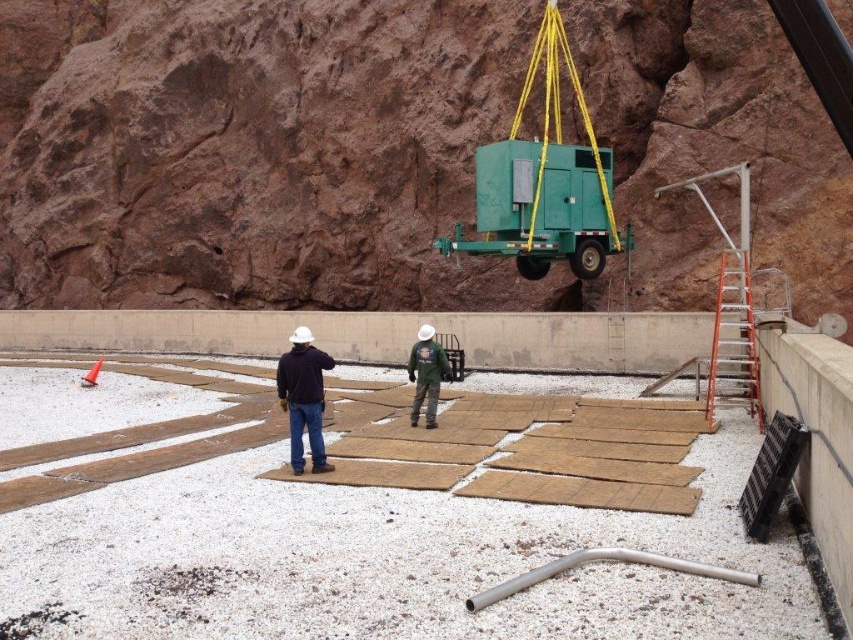
You are a safety inspector assessing the construction site. You need to ensure that the brown wood planks at center can support the green matte trailer at upper center if it were to be placed there. Based on their widths, is this possible?

The brown wood planks at center are wider than the green matte trailer at upper center, so they can support the trailer if placed there.

You are a safety inspector checking the construction site. You notice the brown wood planks at center and the matte black jacket at center. Which object is positioned higher in the image?

The brown wood planks at center are much taller than the matte black jacket at center, so the brown wood planks at center are positioned higher in the image.

You are a crane operator trying to lower the green matte trailer at upper center onto the wooden planks in the foreground. The safety regulations state that the distance between the trailer and the nearest worker must be at least 20 meters. Is the current distance compliant with the safety regulations?

The distance between the green matte trailer at upper center and the nearest worker is 17.54 meters, which is less than the required 20 meters. Therefore, the current distance does not comply with safety regulations.